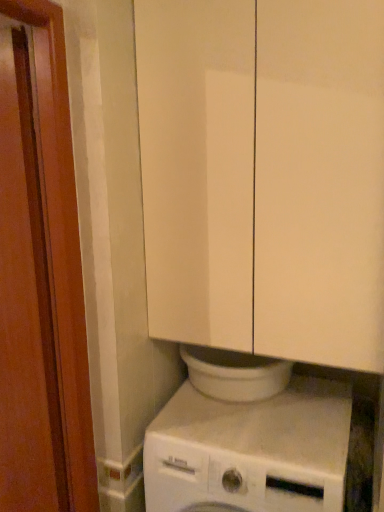
I want to click on free point above white matte washing machine at lower center (from a real-world perspective), so click(x=256, y=419).